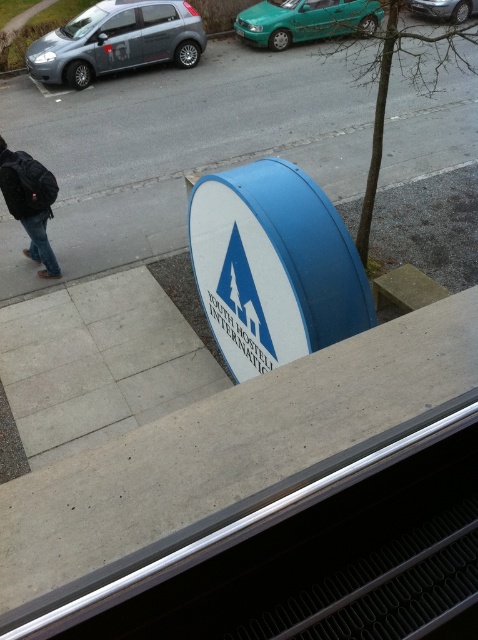
Question: Is teal glossy car at upper center thinner than black backpack at left?

Choices:
 (A) no
 (B) yes

Answer: (A)

Question: Which of the following is the closest to the observer?

Choices:
 (A) (2, 163)
 (B) (291, 298)

Answer: (B)

Question: Is matte gray hatchback at upper left to the left of teal glossy car at upper center from the viewer's perspective?

Choices:
 (A) yes
 (B) no

Answer: (A)

Question: Which object appears farthest from the camera in this image?

Choices:
 (A) matte gray hatchback at upper left
 (B) black backpack at left
 (C) teal glossy car at upper center
 (D) blue matte sign at center

Answer: (C)

Question: Which object is positioned farthest from the teal glossy car at upper center?

Choices:
 (A) blue matte sign at center
 (B) matte gray hatchback at upper left

Answer: (A)

Question: Is blue matte sign at center smaller than black backpack at left?

Choices:
 (A) no
 (B) yes

Answer: (A)